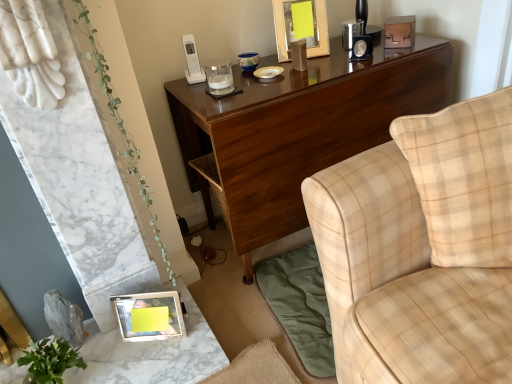
This screenshot has width=512, height=384. I want to click on vacant space in front of metallic silver photo frame at lower left, the 1th picture frame viewed from the front, so click(153, 362).